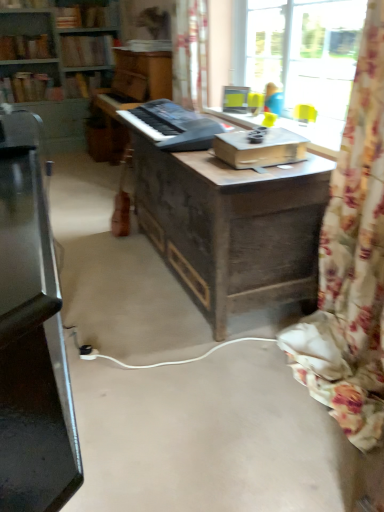
Identify the location of floral fabric curtain at right, which is the 1th curtain from right to left. This screenshot has width=384, height=512. tap(351, 264).

At what (x,y) coordinates should I click in order to perform the action: click on wooden piano at center. Please return your answer as a coordinate pair (x, y). Looking at the image, I should click on (132, 91).

Image resolution: width=384 pixels, height=512 pixels. What do you see at coordinates (56, 50) in the screenshot?
I see `wooden bookcase at upper left` at bounding box center [56, 50].

Describe the element at coordinates (24, 4) in the screenshot. This screenshot has width=384, height=512. I see `hardcover book at upper left, which appears as the first book when viewed from the top` at that location.

This screenshot has width=384, height=512. I want to click on hardcover book at upper left, which is the sixth book in top-to-bottom order, so click(x=29, y=88).

The image size is (384, 512). What do you see at coordinates (230, 224) in the screenshot?
I see `dark wood table at center` at bounding box center [230, 224].

I want to click on dark wood table at center, so click(x=230, y=224).

Where is `floral fabric curtain at right, acting as the first curtain starting from the front`? The width and height of the screenshot is (384, 512). floral fabric curtain at right, acting as the first curtain starting from the front is located at coordinates (351, 264).

Who is bigger, wooden bookshelf at upper left, which is the 4th book from bottom to top, or dark wood table at center?

dark wood table at center.

Locate an element on the screen. Image resolution: width=384 pixels, height=512 pixels. table on the right of the wooden bookshelf at upper left, which is the 4th book from bottom to top is located at coordinates (230, 224).

How much distance is there between wooden bookshelf at upper left, the 3th book from the top, and dark wood table at center?

13.00 feet.

Considering the positions of objects wooden bookshelf at upper left, the 3th book from the top, and dark wood table at center in the image provided, who is more to the right, wooden bookshelf at upper left, the 3th book from the top, or dark wood table at center?

dark wood table at center is more to the right.

Which is nearer, (76, 93) or (45, 51)?

Point (76, 93) is positioned farther from the camera compared to point (45, 51).

Is hardcover book at center, which appears as the second book when ordered from the bottom, aimed at wooden bookshelf at upper left, arranged as the fourth book when viewed from the top?

No, hardcover book at center, which appears as the second book when ordered from the bottom, does not turn towards wooden bookshelf at upper left, arranged as the fourth book when viewed from the top.

From the wooden bookshelf at upper left, acting as the third book starting from the bottom, count 3rd books backward and point to it. Please provide its 2D coordinates.

[(87, 83)]

Measure the distance between hardcover book at center, which appears as the second book when ordered from the bottom, and wooden bookshelf at upper left, arranged as the fourth book when viewed from the top.

The distance of hardcover book at center, which appears as the second book when ordered from the bottom, from wooden bookshelf at upper left, arranged as the fourth book when viewed from the top, is 59.12 centimeters.

How different are the orientations of black plastic keyboard at center and hardcover book at center, placed as the fifth book when sorted from top to bottom, in degrees?

The angular difference between black plastic keyboard at center and hardcover book at center, placed as the fifth book when sorted from top to bottom, is 89.9 degrees.

Does black plastic keyboard at center have a lesser width compared to hardcover book at center, which appears as the second book when ordered from the bottom?

Yes, black plastic keyboard at center is thinner than hardcover book at center, which appears as the second book when ordered from the bottom.

Visually, is black plastic keyboard at center positioned to the left or to the right of hardcover book at center, placed as the fifth book when sorted from top to bottom?

From the image, it's evident that black plastic keyboard at center is to the right of hardcover book at center, placed as the fifth book when sorted from top to bottom.

From the image's perspective, which is below, black plastic keyboard at center or hardcover book at center, which appears as the second book when ordered from the bottom?

black plastic keyboard at center is shown below in the image.

Identify the location of book that is the 1st one when counting leftward from the hardcover book at center, placed as the fifth book when sorted from top to bottom. This screenshot has width=384, height=512. [87, 51].

From a real-world perspective, is wooden bookshelf at upper left, which is the 4th book from bottom to top, on top of hardcover book at center, which appears as the second book when ordered from the bottom?

Indeed, from a real-world perspective, wooden bookshelf at upper left, which is the 4th book from bottom to top, stands above hardcover book at center, which appears as the second book when ordered from the bottom.

From the picture: Who is more distant, wooden bookshelf at upper left, the 3th book from the top, or hardcover book at center, placed as the fifth book when sorted from top to bottom?

hardcover book at center, placed as the fifth book when sorted from top to bottom, is further from the camera.

In the scene shown: Measure the distance between floral fabric curtain at right, which is counted as the second curtain, starting from the back, and hardcover book at upper left, which is the 2th book from top to bottom.

The distance of floral fabric curtain at right, which is counted as the second curtain, starting from the back, from hardcover book at upper left, which is the 2th book from top to bottom, is 5.06 meters.

Which is nearer, (383, 234) or (92, 13)?

Point (383, 234) is closer to the camera than point (92, 13).

Find the location of a particular element. This screenshot has height=512, width=384. the 2nd curtain in front of the hardcover book at upper left, which ranks as the 5th book in bottom-to-top order is located at coordinates (351, 264).

Does hardcover book at upper left, which is the sixth book in top-to-bottom order, have a lesser width compared to wooden bookshelf at upper left, acting as the third book starting from the bottom?

No, hardcover book at upper left, which is the sixth book in top-to-bottom order, is not thinner than wooden bookshelf at upper left, acting as the third book starting from the bottom.

Would you say wooden bookshelf at upper left, acting as the third book starting from the bottom, is part of hardcover book at upper left, which is the sixth book in top-to-bottom order,'s contents?

No, wooden bookshelf at upper left, acting as the third book starting from the bottom, is not inside hardcover book at upper left, which is the sixth book in top-to-bottom order.

Which of these two, hardcover book at upper left, which is the sixth book in top-to-bottom order, or wooden bookshelf at upper left, acting as the third book starting from the bottom, is bigger?

hardcover book at upper left, which is the sixth book in top-to-bottom order, is bigger.

Consider the image. Which of these two, hardcover book at upper left, which is the sixth book in top-to-bottom order, or wooden bookshelf at upper left, arranged as the fourth book when viewed from the top, stands shorter?

Standing shorter between the two is wooden bookshelf at upper left, arranged as the fourth book when viewed from the top.

Could you measure the distance between hardcover book at upper left, marked as the 6th book in a bottom-to-top arrangement, and floral fabric curtain at right, which is the 1th curtain from right to left?

hardcover book at upper left, marked as the 6th book in a bottom-to-top arrangement, is 5.37 meters away from floral fabric curtain at right, which is the 1th curtain from right to left.

Does point (18, 6) appear closer or farther from the camera than point (363, 335)?

Point (18, 6) is farther from the camera than point (363, 335).

Is hardcover book at upper left, marked as the 6th book in a bottom-to-top arrangement, to the right of floral fabric curtain at right, which is the 1th curtain from right to left, from the viewer's perspective?

In fact, hardcover book at upper left, marked as the 6th book in a bottom-to-top arrangement, is to the left of floral fabric curtain at right, which is the 1th curtain from right to left.

Does hardcover book at upper left, which appears as the first book when viewed from the top, turn towards floral fabric curtain at right, marked as the second curtain in a top-to-bottom arrangement?

No.

Where is `table below the wooden bookshelf at upper left, the 3th book from the top (from a real-world perspective)`? table below the wooden bookshelf at upper left, the 3th book from the top (from a real-world perspective) is located at coordinates (230, 224).

From the image's perspective, starting from the hardcover book at center, placed as the fifth book when sorted from top to bottom, which book is the 1st one above? Please provide its 2D coordinates.

[(25, 47)]

Estimate the real-world distances between objects in this image. Which object is further from black plastic keyboard at center, wooden piano at center or brown cardboard book at center?

wooden piano at center lies further to black plastic keyboard at center than the other object.

Based on their spatial positions, is hardcover book at center, placed as the fifth book when sorted from top to bottom, or floral fabric curtain at upper center, the first curtain when ordered from left to right, further from hardcover book at upper left, which ranks as the 5th book in bottom-to-top order?

The object further to hardcover book at upper left, which ranks as the 5th book in bottom-to-top order, is floral fabric curtain at upper center, the first curtain when ordered from left to right.

In the scene shown: Considering their positions, is hardcover book at center, which appears as the second book when ordered from the bottom, positioned further to hardcover book at upper left, which is the 2th book from top to bottom, than wooden bookcase at upper left?

hardcover book at center, which appears as the second book when ordered from the bottom, is further to hardcover book at upper left, which is the 2th book from top to bottom.

Estimate the real-world distances between objects in this image. Which object is further from hardcover book at upper left, which is the 2th book from top to bottom, wooden bookshelf at upper left, which is the 4th book from bottom to top, or floral fabric curtain at right, acting as the 1th curtain starting from the bottom?

floral fabric curtain at right, acting as the 1th curtain starting from the bottom.

Based on their spatial positions, is wooden bookshelf at upper left, the 3th book from the top, or hardcover book at upper left, marked as the 6th book in a bottom-to-top arrangement, further from wooden piano at center?

Among the two, hardcover book at upper left, marked as the 6th book in a bottom-to-top arrangement, is located further to wooden piano at center.

Looking at the image, which one is located further to hardcover book at center, which appears as the second book when ordered from the bottom, floral fabric curtain at upper center, the first curtain when ordered from left to right, or wooden piano at center?

The object further to hardcover book at center, which appears as the second book when ordered from the bottom, is floral fabric curtain at upper center, the first curtain when ordered from left to right.

When comparing their distances from brown cardboard book at center, does hardcover book at upper left, arranged as the first book when ordered from the bottom, or hardcover book at upper left, which appears as the first book when viewed from the top, seem further?

hardcover book at upper left, which appears as the first book when viewed from the top, is further to brown cardboard book at center.

Based on their spatial positions, is black plastic keyboard at center or wooden bookshelf at upper left, which is the 4th book from bottom to top, closer to brown cardboard book at center?

black plastic keyboard at center is positioned closer to the anchor brown cardboard book at center.

At what (x,y) coordinates should I click in order to perform the action: click on curtain between dark wood table at center and hardcover book at center, which appears as the second book when ordered from the bottom, from front to back. Please return your answer as a coordinate pair (x, y). This screenshot has height=512, width=384. Looking at the image, I should click on (190, 53).

Locate an element on the screen. This screenshot has height=512, width=384. musical keyboard between dark wood table at center and wooden bookcase at upper left in the front-back direction is located at coordinates (173, 126).

Where is `bookcase located between floral fabric curtain at right, acting as the first curtain starting from the front, and hardcover book at upper left, which is the 2th book from top to bottom, in the depth direction`? bookcase located between floral fabric curtain at right, acting as the first curtain starting from the front, and hardcover book at upper left, which is the 2th book from top to bottom, in the depth direction is located at coordinates (56, 50).

Image resolution: width=384 pixels, height=512 pixels. Find the location of `bookcase between wooden piano at center and hardcover book at upper left, which is the sixth book in top-to-bottom order, in the front-back direction`. bookcase between wooden piano at center and hardcover book at upper left, which is the sixth book in top-to-bottom order, in the front-back direction is located at coordinates (56, 50).